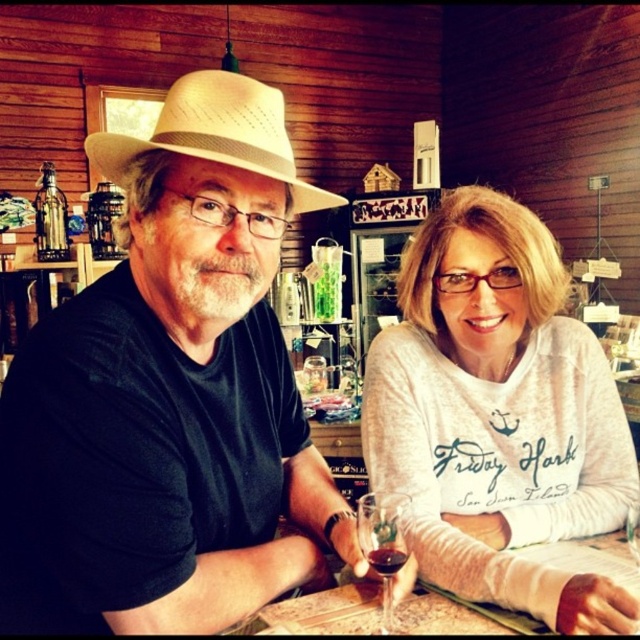
You are a bartender preparing to place a new item on the bar. You have a matte straw hat at center and a translucent glass at lower center. Which item requires a wider space on the bar?

The matte straw hat at center requires a wider space on the bar because its width is larger than the translucent glass at lower center.

You are a barista preparing to place a coaster under the matte straw hat at center and the white soft sweater at center. Which item requires a smaller coaster due to its size?

The matte straw hat at center requires a smaller coaster because it has a lesser width compared to the white soft sweater at center.

You are a photographer trying to capture a clear shot of both the matte straw hat at center and the white soft sweater at center. Since the camera can only focus on one object at a time, which object should you choose to ensure it appears in focus while the other remains somewhat sharp?

The matte straw hat at center is much taller than the white soft sweater at center, so focusing on the taller object would allow the shorter one to stay somewhat sharp in the background.